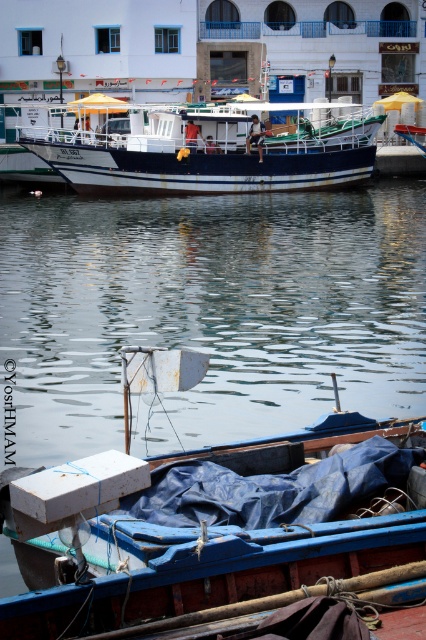
Who is higher up, blue tarpaulin boat at lower center or white glossy boat at center?

Positioned higher is white glossy boat at center.

Is blue tarpaulin boat at lower center shorter than white glossy boat at center?

Correct, blue tarpaulin boat at lower center is not as tall as white glossy boat at center.

Describe the element at coordinates (207, 532) in the screenshot. I see `blue tarpaulin boat at lower center` at that location.

Where is `blue tarpaulin boat at lower center`? The image size is (426, 640). blue tarpaulin boat at lower center is located at coordinates (207, 532).

Is point (25, 266) behind point (271, 513)?

Yes.

Who is higher up, clear water at center or blue tarpaulin boat at lower center?

clear water at center is above.

Which is behind, point (411, 289) or point (135, 506)?

The point (411, 289) is behind.

Locate an element on the screen. clear water at center is located at coordinates (212, 308).

Which of these two, clear water at center or white glossy boat at center, stands shorter?

Standing shorter between the two is white glossy boat at center.

Describe the element at coordinates (212, 308) in the screenshot. I see `clear water at center` at that location.

Find the location of a particular element. This screenshot has height=640, width=426. clear water at center is located at coordinates (212, 308).